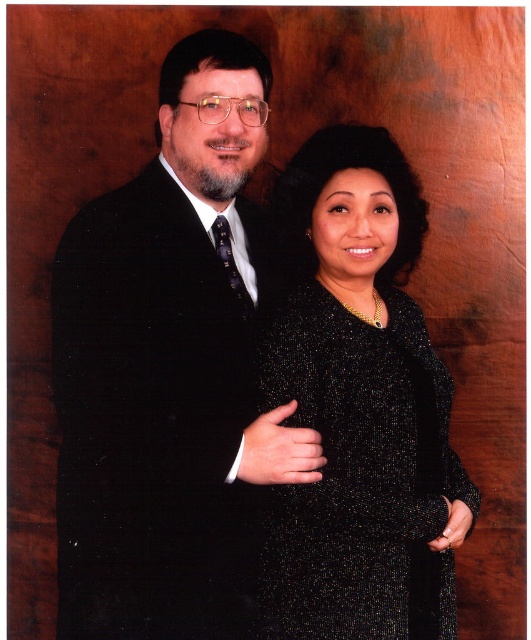
Between matte black suit at left and black sequined dress at center, which one appears on the left side from the viewer's perspective?

Positioned to the left is matte black suit at left.

Is point (145, 260) more distant than point (330, 532)?

No, (145, 260) is closer to viewer.

Which is behind, point (247, 205) or point (391, 296)?

Positioned behind is point (247, 205).

This screenshot has height=640, width=531. In order to click on matte black suit at left in this screenshot , I will do `click(167, 369)`.